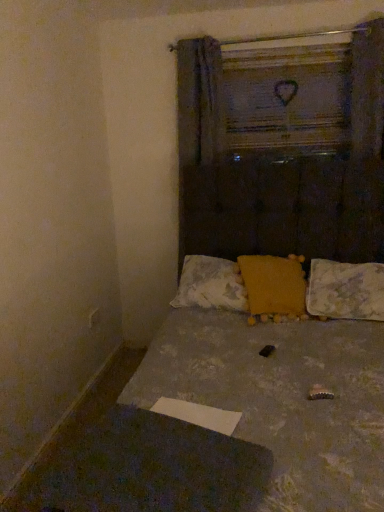
Question: Considering the positions of yellow fabric pillow at center, which is counted as the 1th pillow, starting from the left, and wooden frame at upper center in the image, is yellow fabric pillow at center, which is counted as the 1th pillow, starting from the left, taller or shorter than wooden frame at upper center?

Choices:
 (A) tall
 (B) short

Answer: (B)

Question: Based on their sizes in the image, would you say yellow fabric pillow at center, placed as the 3th pillow when sorted from right to left, is bigger or smaller than wooden frame at upper center?

Choices:
 (A) big
 (B) small

Answer: (A)

Question: Considering the real-world distances, which object is closest to the fluffy white pillow at lower right, placed as the third pillow when sorted from left to right?

Choices:
 (A) yellow fabric pillow at center, which is counted as the 1th pillow, starting from the left
 (B) yellow fuzzy pillow at center, which ranks as the second pillow in right-to-left order
 (C) wooden frame at upper center
 (D) fluffy fabric bed at center

Answer: (B)

Question: Considering the real-world distances, which object is farthest from the yellow fuzzy pillow at center, which ranks as the second pillow in right-to-left order?

Choices:
 (A) fluffy fabric bed at center
 (B) fluffy white pillow at lower right, marked as the first pillow in a right-to-left arrangement
 (C) yellow fabric pillow at center, placed as the 3th pillow when sorted from right to left
 (D) wooden frame at upper center

Answer: (D)